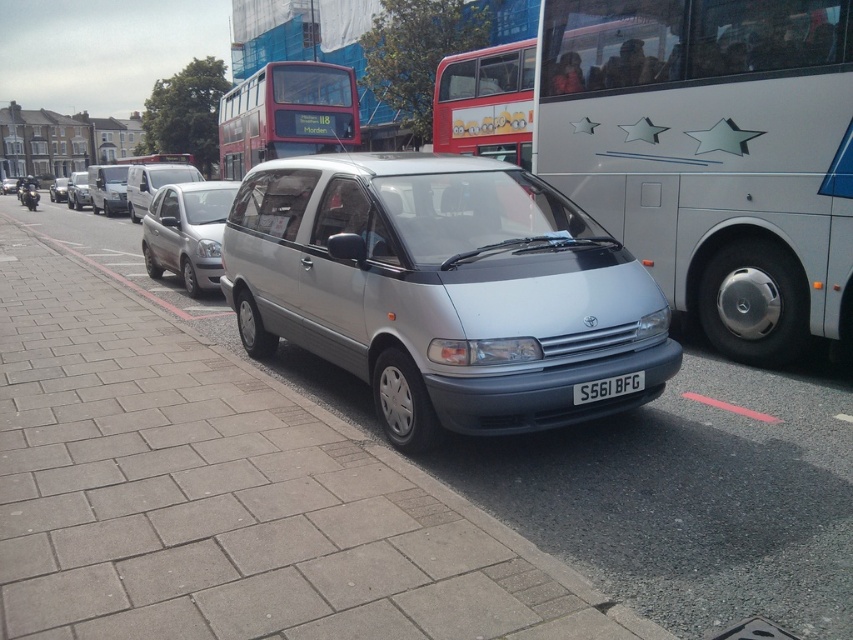
You are a drone operator trying to capture a photo of the red metallic bus at upper center and the black plastic license plate at center in the same frame. The drone can only capture objects within a 20 meter range. Can you confirm if both objects are within the drone camera range?

The distance between the red metallic bus at upper center and the black plastic license plate at center is 16.68 meters, which is within the 20 meter range. Therefore, both objects can be captured in the same frame.